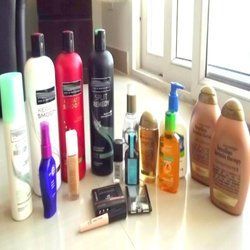
Where is `window frame`? The image size is (250, 250). window frame is located at coordinates (198, 59), (144, 75).